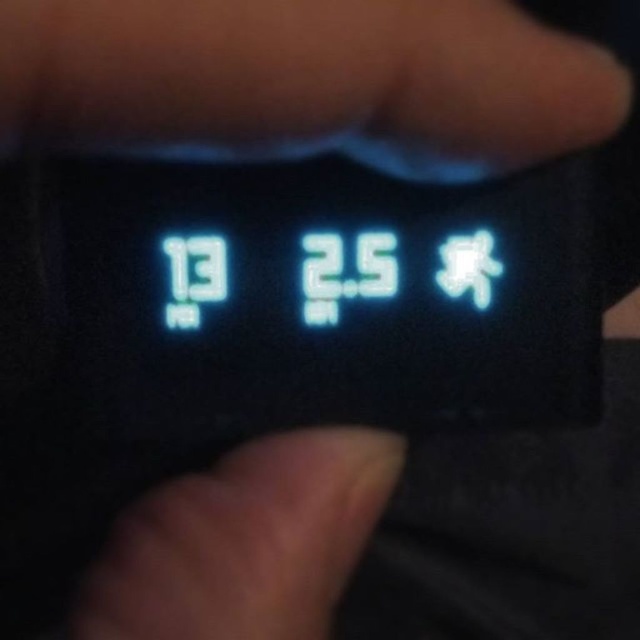
Does black matte hand at upper center have a greater width compared to smooth skin at center?

Yes, black matte hand at upper center is wider than smooth skin at center.

Who is more distant from viewer, (220, 8) or (204, 605)?

Point (204, 605)

Identify the location of black matte hand at upper center. (307, 72).